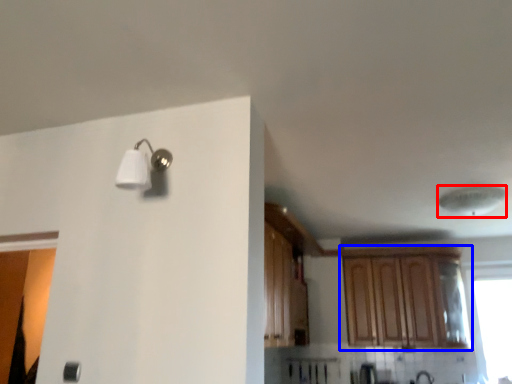
Question: Which of the following is the farthest to the observer, lamp (highlighted by a red box) or cabinetry (highlighted by a blue box)?

Choices:
 (A) lamp
 (B) cabinetry

Answer: (B)